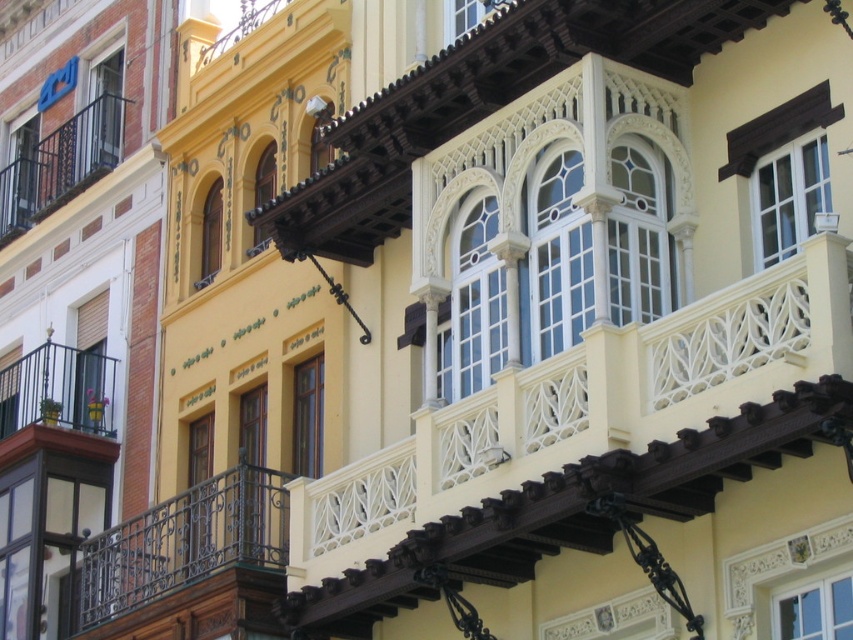
Question: Can you confirm if rustic wrought iron balcony at left is positioned to the left of black wrought iron balcony at left?

Choices:
 (A) no
 (B) yes

Answer: (A)

Question: Which is farther from the black wrought iron railing at left?

Choices:
 (A) rustic wrought iron balcony at left
 (B) black wrought iron balcony at left

Answer: (B)

Question: Which is farther from the black wrought iron railing at left?

Choices:
 (A) rustic wrought iron balcony at left
 (B) black wrought iron balcony at left

Answer: (B)

Question: Does rustic wrought iron balcony at left lie in front of black wrought iron balcony at left?

Choices:
 (A) yes
 (B) no

Answer: (A)

Question: Which object is the closest to the black wrought iron railing at left?

Choices:
 (A) rustic wrought iron balcony at left
 (B) black wrought iron balcony at left

Answer: (A)

Question: Does black wrought iron railing at left appear under black wrought iron balcony at left?

Choices:
 (A) no
 (B) yes

Answer: (B)